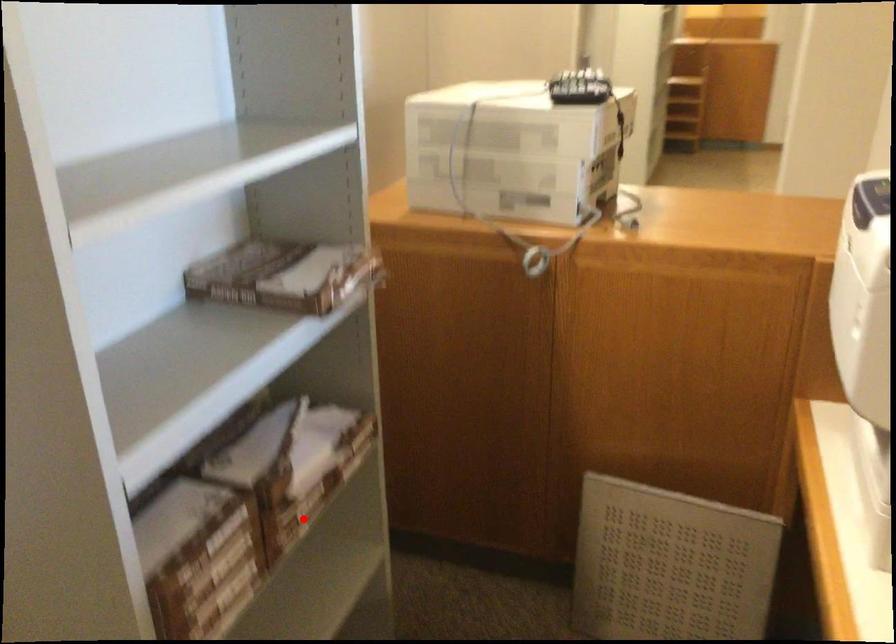
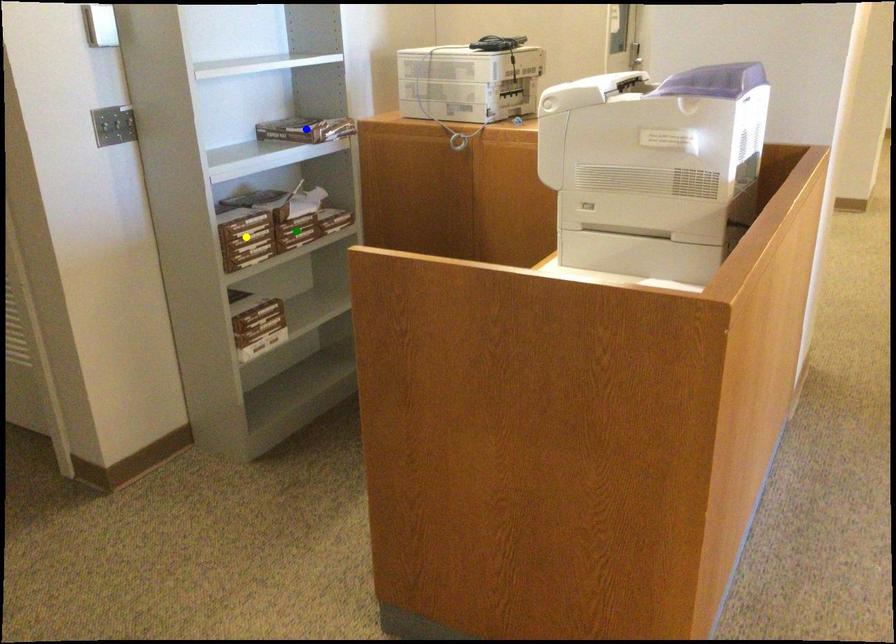
Question: I am providing you with two images of the same scene from different viewpoints. A red point is marked on the first image. You are given multiple points on the second image. In image 2, which mark is for the same physical point as the one in image 1?

Choices:
 (A) blue point
 (B) yellow point
 (C) green point

Answer: (C)